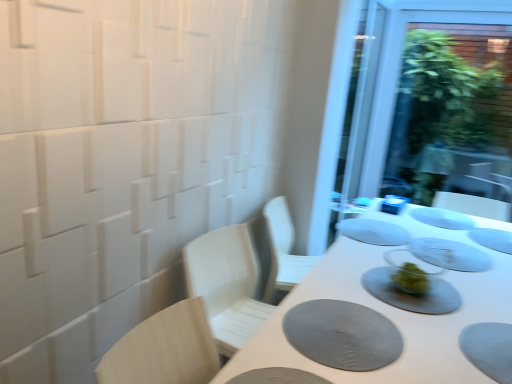
This screenshot has height=384, width=512. I want to click on vacant area that is in front of matte gray placemat at center, the first tableware in the front-to-back sequence, so click(x=437, y=335).